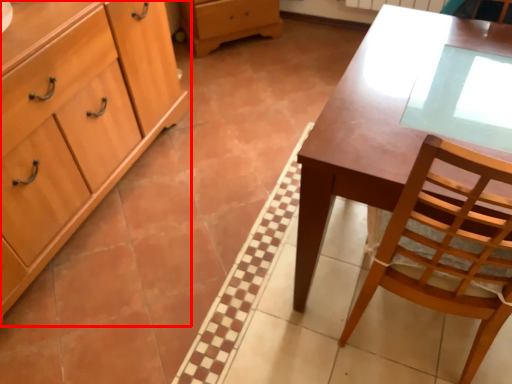
Question: Considering the relative positions of cabinetry (annotated by the red box) and desk in the image provided, where is cabinetry (annotated by the red box) located with respect to the staircase?

Choices:
 (A) right
 (B) left

Answer: (B)